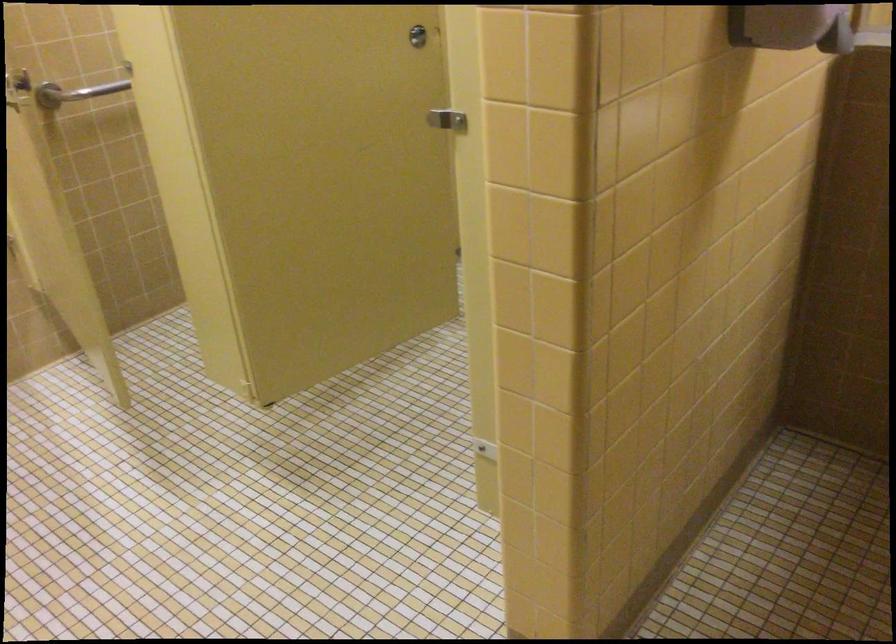
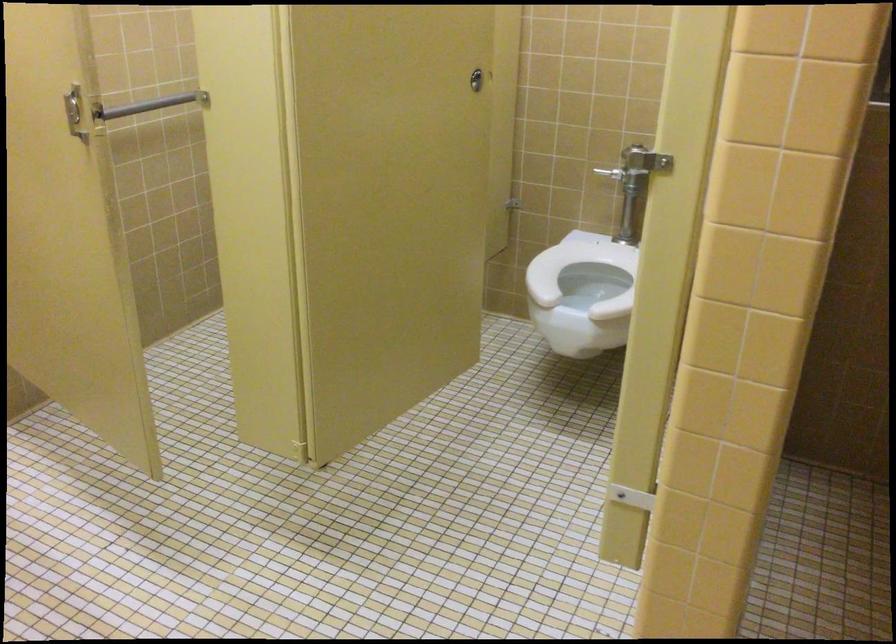
Locate, in the second image, the point that corresponds to pixel 444 129 in the first image.

(644, 160)